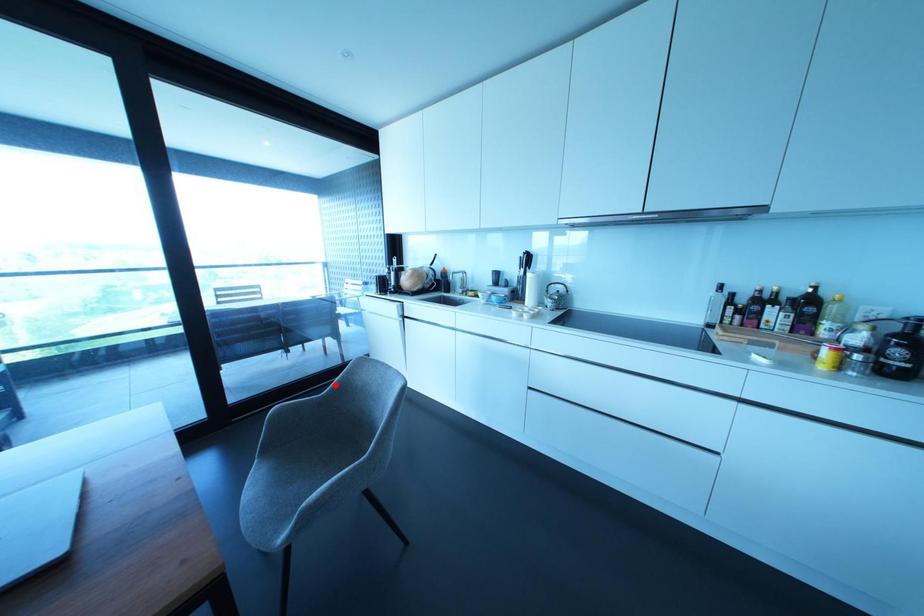
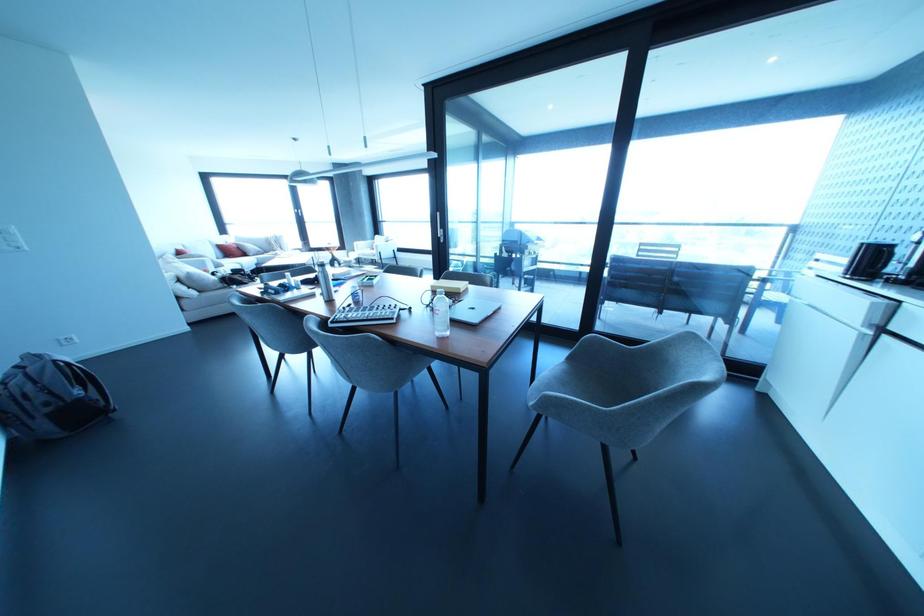
Question: I am providing you with two images of the same scene from different viewpoints. Image1 has a red point marked. In image2, the corresponding 3D location appears at what relative position? Reply with the corresponding letter.

Choices:
 (A) Closer
 (B) Farther

Answer: (A)